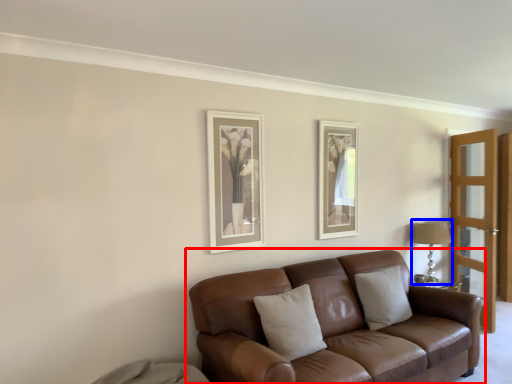
Question: Which object is closer to the camera taking this photo, studio couch (highlighted by a red box) or table lamp (highlighted by a blue box)?

Choices:
 (A) studio couch
 (B) table lamp

Answer: (A)